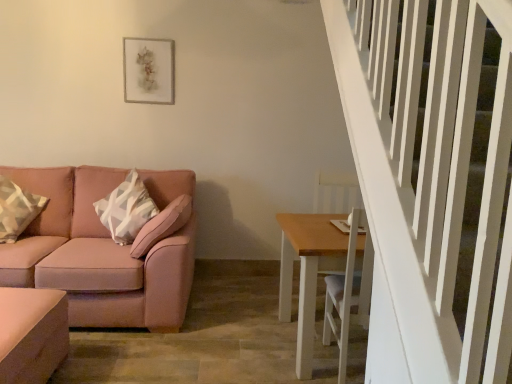
Question: From the image's perspective, is matte gray picture frame at upper center under light brown wooden table at lower right, which is the second table from left to right?

Choices:
 (A) yes
 (B) no

Answer: (B)

Question: Is matte gray picture frame at upper center to the left of light brown wooden table at lower right, which is the second table from left to right, from the viewer's perspective?

Choices:
 (A) no
 (B) yes

Answer: (B)

Question: Does matte gray picture frame at upper center have a smaller size compared to light brown wooden table at lower right, acting as the 1th table starting from the right?

Choices:
 (A) yes
 (B) no

Answer: (A)

Question: Could you tell me if matte gray picture frame at upper center is facing light brown wooden table at lower right, which is the second table from left to right?

Choices:
 (A) yes
 (B) no

Answer: (B)

Question: Does matte gray picture frame at upper center have a larger size compared to light brown wooden table at lower right, which is the second table from left to right?

Choices:
 (A) yes
 (B) no

Answer: (B)

Question: Does point (309, 266) appear closer or farther from the camera than point (24, 228)?

Choices:
 (A) farther
 (B) closer

Answer: (B)

Question: From the image's perspective, is light brown wooden table at lower right, acting as the 1th table starting from the right, located above or below geometric-patterned fabric pillow at left?

Choices:
 (A) below
 (B) above

Answer: (A)

Question: In terms of size, does light brown wooden table at lower right, acting as the 1th table starting from the right, appear bigger or smaller than geometric-patterned fabric pillow at left?

Choices:
 (A) small
 (B) big

Answer: (B)

Question: From a real-world perspective, is light brown wooden table at lower right, which is the second table from left to right, physically located above or below geometric-patterned fabric pillow at left?

Choices:
 (A) above
 (B) below

Answer: (B)

Question: In terms of height, does light brown wooden table at lower right, acting as the 1th table starting from the right, look taller or shorter compared to pink fabric couch at left?

Choices:
 (A) short
 (B) tall

Answer: (A)

Question: From a real-world perspective, is light brown wooden table at lower right, acting as the 1th table starting from the right, above or below pink fabric couch at left?

Choices:
 (A) below
 (B) above

Answer: (A)

Question: Looking at their shapes, would you say light brown wooden table at lower right, acting as the 1th table starting from the right, is wider or thinner than pink fabric couch at left?

Choices:
 (A) wide
 (B) thin

Answer: (B)

Question: From the image's perspective, relative to pink fabric couch at left, is light brown wooden table at lower right, acting as the 1th table starting from the right, above or below?

Choices:
 (A) above
 (B) below

Answer: (B)

Question: Is matte pink ottoman at lower left, the 1th table positioned from the left, inside or outside of geometric-patterned fabric pillow at left?

Choices:
 (A) outside
 (B) inside

Answer: (A)

Question: Is point (15, 379) positioned closer to the camera than point (27, 223)?

Choices:
 (A) closer
 (B) farther

Answer: (A)